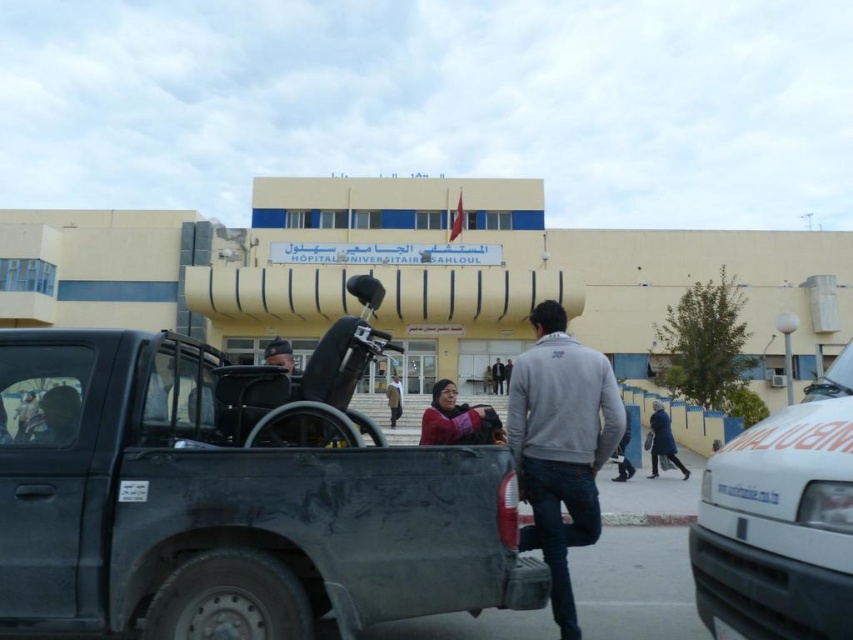
You are a delivery person who needs to unload a package from the matte black truck at center. There is a gray matte jacket at center nearby. Is there enough space to move around the truck to access the rear door?

The matte black truck at center is positioned under the gray matte jacket at center, which means the jacket is above the truck. This suggests there is enough vertical space to move around the truck and access the rear door.

You are a hospital staff member needing to move a patient from the pickup truck to the white matte van at right. Considering the gray matte jacket at center is blocking the path, can you safely navigate the wheelchair through the space between them?

The white matte van at right is closer to the viewer than the gray matte jacket at center, so there is enough space to navigate the wheelchair safely between them.